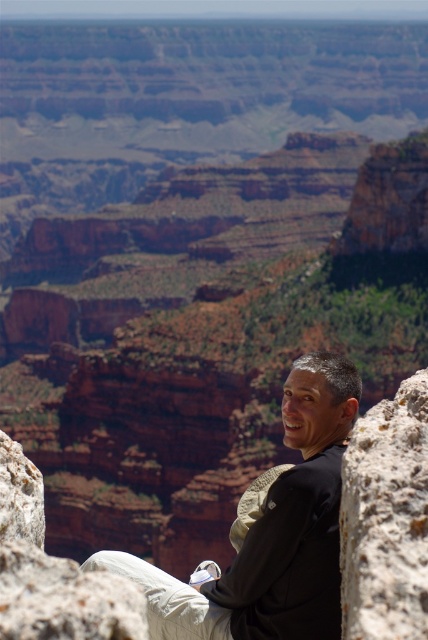
Can you confirm if matte black shirt at center is smaller than rusty rock at right?

No, matte black shirt at center is not smaller than rusty rock at right.

Which is in front, point (327, 618) or point (347, 476)?

Point (347, 476) is in front.

Is point (269, 541) positioned in front of point (371, 541)?

No.

You are a GUI agent. You are given a task and a screenshot of the screen. Output one action in this format:
    pyautogui.click(x=<x>, y=<y>)
    Task: Click on the matte black shirt at center
    The height and width of the screenshot is (640, 428).
    Given the screenshot: What is the action you would take?
    pyautogui.click(x=272, y=532)